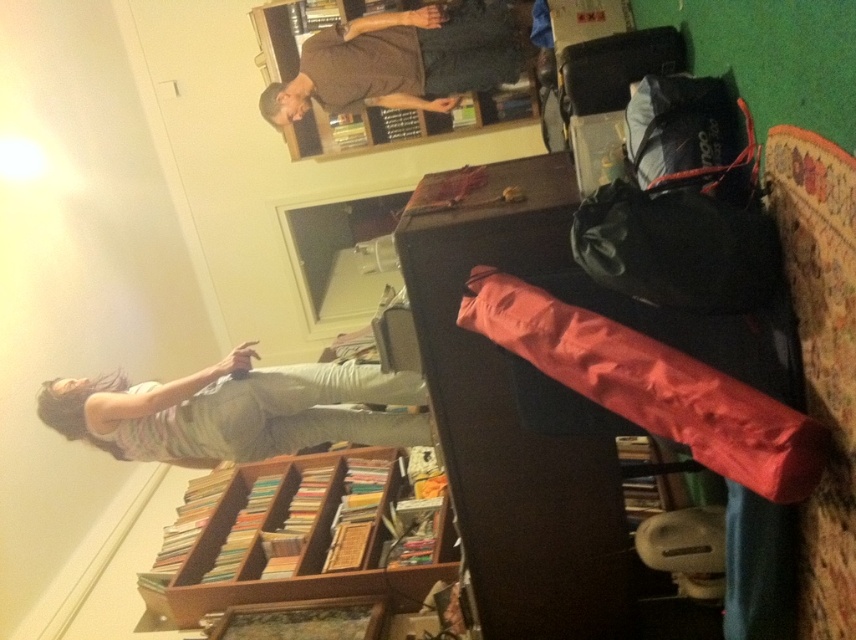
Question: Which of the following is the farthest from the observer?

Choices:
 (A) (393, 497)
 (B) (183, 378)

Answer: (A)

Question: Is wooden bookshelf at lower center thinner than striped cotton shirt at lower left?

Choices:
 (A) no
 (B) yes

Answer: (B)

Question: From the image, what is the correct spatial relationship of wooden bookshelf at lower center in relation to striped cotton shirt at lower left?

Choices:
 (A) left
 (B) right

Answer: (B)

Question: Based on their relative distances, which object is farther from the wooden bookshelf at lower center?

Choices:
 (A) brown matte shirt at upper center
 (B) striped cotton shirt at lower left

Answer: (A)

Question: Is striped cotton shirt at lower left wider than brown matte shirt at upper center?

Choices:
 (A) no
 (B) yes

Answer: (A)

Question: Which of these objects is positioned farthest from the brown matte shirt at upper center?

Choices:
 (A) wooden bookshelf at lower center
 (B) striped cotton shirt at lower left

Answer: (A)